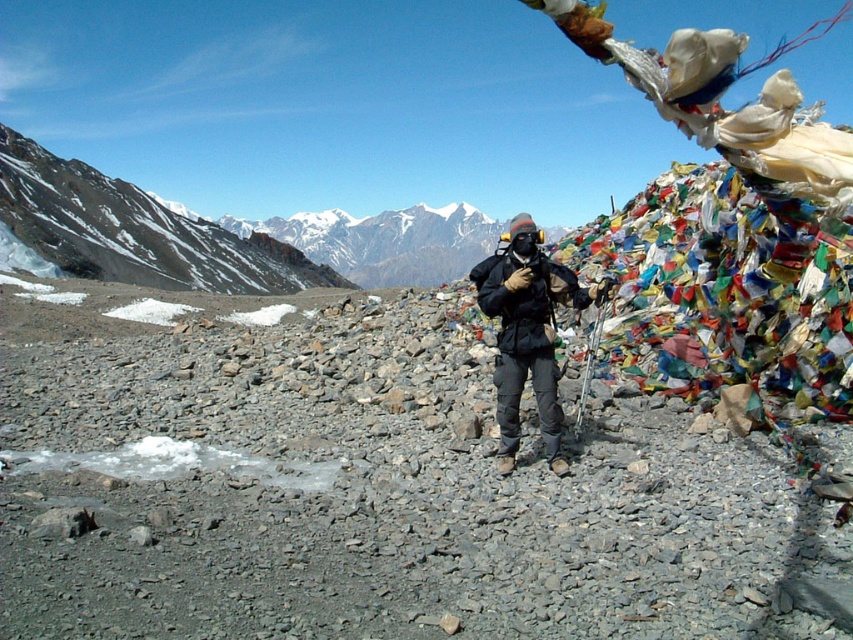
Can you confirm if gray gravel at center is positioned above black matte jacket at center?

Actually, gray gravel at center is below black matte jacket at center.

Who is taller, gray gravel at center or black matte jacket at center?

black matte jacket at center is taller.

Measure the distance between gray gravel at center and camera.

gray gravel at center and camera are 11.86 meters apart from each other.

Identify the location of gray gravel at center. The image size is (853, 640). (364, 484).